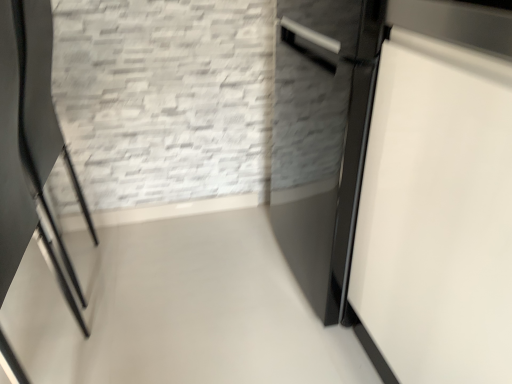
Question: Is white glossy door at right wider than black glossy chair at left?

Choices:
 (A) no
 (B) yes

Answer: (B)

Question: From a real-world perspective, is white glossy door at right located beneath black glossy chair at left?

Choices:
 (A) no
 (B) yes

Answer: (A)

Question: Does white glossy door at right have a smaller size compared to black glossy chair at left?

Choices:
 (A) no
 (B) yes

Answer: (A)

Question: Can you confirm if white glossy door at right is shorter than black glossy chair at left?

Choices:
 (A) no
 (B) yes

Answer: (A)

Question: Is white glossy door at right to the left of black glossy chair at left from the viewer's perspective?

Choices:
 (A) yes
 (B) no

Answer: (B)

Question: Is white glossy door at right not near black glossy chair at left?

Choices:
 (A) no
 (B) yes

Answer: (A)

Question: Is black glossy chair at left smaller than white glossy door at right?

Choices:
 (A) yes
 (B) no

Answer: (A)

Question: From the image's perspective, does black glossy chair at left appear lower than white glossy door at right?

Choices:
 (A) yes
 (B) no

Answer: (A)

Question: Can you confirm if black glossy chair at left is bigger than white glossy door at right?

Choices:
 (A) no
 (B) yes

Answer: (A)

Question: Does black glossy chair at left lie in front of white glossy door at right?

Choices:
 (A) yes
 (B) no

Answer: (B)

Question: Considering the relative positions of black glossy chair at left and white glossy door at right in the image provided, is black glossy chair at left to the left of white glossy door at right from the viewer's perspective?

Choices:
 (A) no
 (B) yes

Answer: (B)

Question: Is black glossy chair at left placed right next to white glossy door at right?

Choices:
 (A) yes
 (B) no

Answer: (B)

Question: Is point (15, 163) positioned closer to the camera than point (445, 193)?

Choices:
 (A) farther
 (B) closer

Answer: (A)